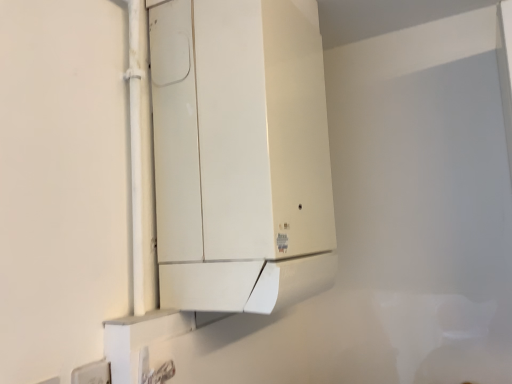
Question: Does white plastic electric outlet at lower left contain white matte cabinet at center?

Choices:
 (A) yes
 (B) no

Answer: (B)

Question: From a real-world perspective, is white plastic electric outlet at lower left located higher than white matte cabinet at center?

Choices:
 (A) no
 (B) yes

Answer: (A)

Question: Is white plastic electric outlet at lower left looking in the opposite direction of white matte cabinet at center?

Choices:
 (A) yes
 (B) no

Answer: (B)

Question: Does white plastic electric outlet at lower left appear on the left side of white matte cabinet at center?

Choices:
 (A) no
 (B) yes

Answer: (B)

Question: Is the position of white plastic electric outlet at lower left more distant than that of white matte cabinet at center?

Choices:
 (A) no
 (B) yes

Answer: (A)

Question: From the image's perspective, is white plastic electric outlet at lower left beneath white matte cabinet at center?

Choices:
 (A) no
 (B) yes

Answer: (B)

Question: Would you say white matte cabinet at center is outside white plastic electric outlet at lower left?

Choices:
 (A) yes
 (B) no

Answer: (A)

Question: Does white matte cabinet at center have a greater width compared to white plastic electric outlet at lower left?

Choices:
 (A) yes
 (B) no

Answer: (A)

Question: Can you confirm if white matte cabinet at center is thinner than white plastic electric outlet at lower left?

Choices:
 (A) no
 (B) yes

Answer: (A)

Question: Are white matte cabinet at center and white plastic electric outlet at lower left beside each other?

Choices:
 (A) yes
 (B) no

Answer: (B)

Question: From the image's perspective, is white matte cabinet at center on white plastic electric outlet at lower left?

Choices:
 (A) no
 (B) yes

Answer: (B)

Question: Is white plastic electric outlet at lower left completely or partially inside white matte cabinet at center?

Choices:
 (A) yes
 (B) no

Answer: (B)

Question: In terms of width, does white matte cabinet at center look wider or thinner when compared to white plastic electric outlet at lower left?

Choices:
 (A) thin
 (B) wide

Answer: (B)